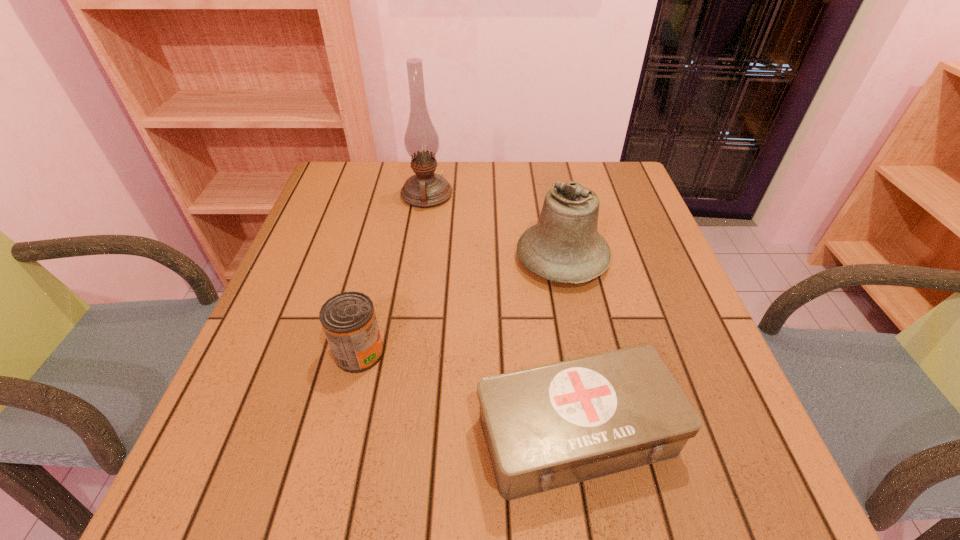
This screenshot has height=540, width=960. I want to click on free space located 0.150m on the back of the second nearest object, so click(376, 281).

Identify the location of vacant area situated on the back of the first-aid kit. This screenshot has width=960, height=540. (547, 257).

What are the coordinates of `object present at the far edge` in the screenshot? It's located at (426, 189).

Where is `object that is at the near edge`? object that is at the near edge is located at coordinates (546, 427).

This screenshot has height=540, width=960. I want to click on bell positioned at the right edge, so click(565, 246).

Image resolution: width=960 pixels, height=540 pixels. I want to click on the first-aid kit that is at the right edge, so click(546, 427).

The image size is (960, 540). Find the location of `object that is positioned at the near right corner`. object that is positioned at the near right corner is located at coordinates (546, 427).

Locate an element on the screen. free point at the far edge is located at coordinates (442, 207).

This screenshot has width=960, height=540. Find the location of `vacant space at the near edge of the desktop`. vacant space at the near edge of the desktop is located at coordinates (296, 511).

In the image, there is a desktop. Identify the location of free space at the left edge. (223, 400).